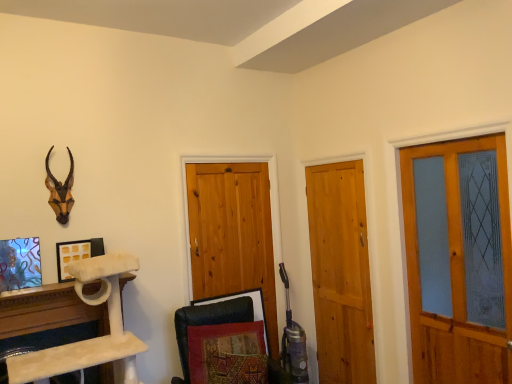
What do you see at coordinates (213, 319) in the screenshot? I see `black leather swivel chair at lower center` at bounding box center [213, 319].

Locate an element on the screen. This screenshot has width=512, height=384. light brown wooden door at center, which is counted as the first barn door, starting from the right is located at coordinates (340, 273).

How much space does light brown wooden door at center, which is counted as the first barn door, starting from the right, occupy horizontally?

It is 2.45 inches.

In order to face natural wood barn door at center, which is the first barn door from left to right, should I rotate leftwards or rightwards?

Turn left approximately 2.887 degrees to face it.

Describe the element at coordinates (460, 260) in the screenshot. The image size is (512, 384). I see `matte wooden screen door at right` at that location.

The image size is (512, 384). What do you see at coordinates (76, 254) in the screenshot? I see `white matte picture frame at upper left, the second picture frame when ordered from left to right` at bounding box center [76, 254].

Find the location of `black leather swivel chair at lower center`. black leather swivel chair at lower center is located at coordinates (213, 319).

Where is `screen door on the right of black leather swivel chair at lower center`? screen door on the right of black leather swivel chair at lower center is located at coordinates (460, 260).

What's the angular difference between black leather swivel chair at lower center and matte wooden screen door at right's facing directions?

The angular difference between black leather swivel chair at lower center and matte wooden screen door at right is 82.3 degrees.

From a real-world perspective, is black leather swivel chair at lower center on matte wooden screen door at right?

Incorrect, from a real-world perspective, black leather swivel chair at lower center is lower than matte wooden screen door at right.

How distant is black leather swivel chair at lower center from matte wooden screen door at right?

They are 4.72 feet apart.

Is white marble cat tree at lower left not inside matte wooden screen door at right?

That's correct, white marble cat tree at lower left is outside of matte wooden screen door at right.

Considering the sizes of white marble cat tree at lower left and matte wooden screen door at right in the image, is white marble cat tree at lower left wider or thinner than matte wooden screen door at right?

Clearly, white marble cat tree at lower left has more width compared to matte wooden screen door at right.

Which is further, (41, 374) or (480, 144)?

The point (480, 144) is behind.

Is matte wooden screen door at right facing away from white marble cat tree at lower left?

No.

Is matte wooden screen door at right next to white marble cat tree at lower left and touching it?

matte wooden screen door at right and white marble cat tree at lower left are clearly separated.

Which object is positioned more to the left, matte wooden screen door at right or white marble cat tree at lower left?

From the viewer's perspective, white marble cat tree at lower left appears more on the left side.

Looking at this image, measure the distance from matte wooden screen door at right to white marble cat tree at lower left.

matte wooden screen door at right is 2.11 meters away from white marble cat tree at lower left.

Is white matte picture frame at upper left, the first picture frame viewed from the back, completely or partially outside of black leather swivel chair at lower center?

That's correct, white matte picture frame at upper left, the first picture frame viewed from the back, is outside of black leather swivel chair at lower center.

Is white matte picture frame at upper left, which appears as the second picture frame when viewed from the front, smaller than black leather swivel chair at lower center?

Yes.

From the image's perspective, is white matte picture frame at upper left, the first picture frame when ordered from right to left, on black leather swivel chair at lower center?

Yes, from the image's perspective, white matte picture frame at upper left, the first picture frame when ordered from right to left, is over black leather swivel chair at lower center.

In the image, is white matte picture frame at upper left, which appears as the second picture frame when viewed from the front, positioned in front of or behind black leather swivel chair at lower center?

Visually, white matte picture frame at upper left, which appears as the second picture frame when viewed from the front, is located behind black leather swivel chair at lower center.

Which of these two, white matte picture frame at upper left, the second picture frame when ordered from left to right, or light brown wooden door at center, marked as the 2th barn door in a left-to-right arrangement, stands shorter?

Standing shorter between the two is white matte picture frame at upper left, the second picture frame when ordered from left to right.

Is point (90, 242) behind point (357, 338)?

No, it is in front of (357, 338).

From the picture: Are white matte picture frame at upper left, the second picture frame when ordered from left to right, and light brown wooden door at center, which is counted as the first barn door, starting from the right, located far from each other?

Yes, white matte picture frame at upper left, the second picture frame when ordered from left to right, is far from light brown wooden door at center, which is counted as the first barn door, starting from the right.

Consider the image. Which of these two, light brown wooden door at center, which is counted as the first barn door, starting from the right, or brown matte/decorative animal head at upper left, stands shorter?

With less height is brown matte/decorative animal head at upper left.

Based on the photo, is the depth of light brown wooden door at center, marked as the 2th barn door in a left-to-right arrangement, greater than that of brown matte/decorative animal head at upper left?

Yes, light brown wooden door at center, marked as the 2th barn door in a left-to-right arrangement, is behind brown matte/decorative animal head at upper left.

Is light brown wooden door at center, which is counted as the first barn door, starting from the right, thinner than brown matte/decorative animal head at upper left?

Correct, the width of light brown wooden door at center, which is counted as the first barn door, starting from the right, is less than that of brown matte/decorative animal head at upper left.

Is light brown wooden door at center, which is counted as the first barn door, starting from the right, facing away from brown matte/decorative animal head at upper left?

light brown wooden door at center, which is counted as the first barn door, starting from the right, is not turned away from brown matte/decorative animal head at upper left.

Locate an element on the screen. Image resolution: width=512 pixels, height=384 pixels. screen door below the stained glass picture frame at lower left, marked as the first picture frame in a left-to-right arrangement (from a real-world perspective) is located at coordinates (460, 260).

Is stained glass picture frame at lower left, arranged as the 2th picture frame when viewed from the right, positioned before matte wooden screen door at right?

No, it is not.

The width and height of the screenshot is (512, 384). In order to click on screen door behind the black leather swivel chair at lower center in this screenshot , I will do `click(460, 260)`.

Locate an element on the screen. furniture that is below the matte wooden screen door at right (from the image's perspective) is located at coordinates (60, 326).

Estimate the real-world distances between objects in this image. Which object is further from stained glass picture frame at lower left, the second picture frame when ordered from back to front, white matte picture frame at upper left, the second picture frame when ordered from left to right, or light brown wooden door at center, marked as the 2th barn door in a left-to-right arrangement?

Based on the image, light brown wooden door at center, marked as the 2th barn door in a left-to-right arrangement, appears to be further to stained glass picture frame at lower left, the second picture frame when ordered from back to front.

Which object lies further to the anchor point matte wooden screen door at right, black leather swivel chair at lower center or stained glass picture frame at lower left, which is the first picture frame from front to back?

stained glass picture frame at lower left, which is the first picture frame from front to back, is further to matte wooden screen door at right.

Considering their positions, is black leather swivel chair at lower center positioned closer to matte wooden screen door at right than natural wood barn door at center, which is the first barn door from left to right?

The object closer to matte wooden screen door at right is natural wood barn door at center, which is the first barn door from left to right.

Estimate the real-world distances between objects in this image. Which object is further from white matte picture frame at upper left, the second picture frame when ordered from left to right, stained glass picture frame at lower left, marked as the first picture frame in a left-to-right arrangement, or white marble cat tree at lower left?

The object further to white matte picture frame at upper left, the second picture frame when ordered from left to right, is white marble cat tree at lower left.

Considering their positions, is black leather swivel chair at lower center positioned closer to matte wooden screen door at right than light brown wooden door at center, which is counted as the first barn door, starting from the right?

light brown wooden door at center, which is counted as the first barn door, starting from the right, is closer to matte wooden screen door at right.

When comparing their distances from black leather swivel chair at lower center, does matte wooden screen door at right or stained glass picture frame at lower left, which is the first picture frame from front to back, seem further?

matte wooden screen door at right is positioned further to the anchor black leather swivel chair at lower center.

From the image, which object appears to be nearer to brown matte/decorative animal head at upper left, white matte picture frame at upper left, the first picture frame viewed from the back, or matte wooden screen door at right?

The object closer to brown matte/decorative animal head at upper left is white matte picture frame at upper left, the first picture frame viewed from the back.

When comparing their distances from white matte picture frame at upper left, the first picture frame viewed from the back, does stained glass picture frame at lower left, arranged as the 2th picture frame when viewed from the right, or matte wooden screen door at right seem further?

matte wooden screen door at right lies further to white matte picture frame at upper left, the first picture frame viewed from the back, than the other object.

Image resolution: width=512 pixels, height=384 pixels. I want to click on picture frame situated between white marble cat tree at lower left and black leather swivel chair at lower center from left to right, so click(x=76, y=254).

The image size is (512, 384). I want to click on swivel chair located between brown matte/decorative animal head at upper left and light brown wooden door at center, which is counted as the first barn door, starting from the right, in the left-right direction, so click(x=213, y=319).

The image size is (512, 384). Find the location of `picture frame located between white marble cat tree at lower left and matte wooden screen door at right in the left-right direction`. picture frame located between white marble cat tree at lower left and matte wooden screen door at right in the left-right direction is located at coordinates tap(76, 254).

The width and height of the screenshot is (512, 384). In order to click on swivel chair between brown matte/decorative animal head at upper left and matte wooden screen door at right in the horizontal direction in this screenshot , I will do `click(213, 319)`.